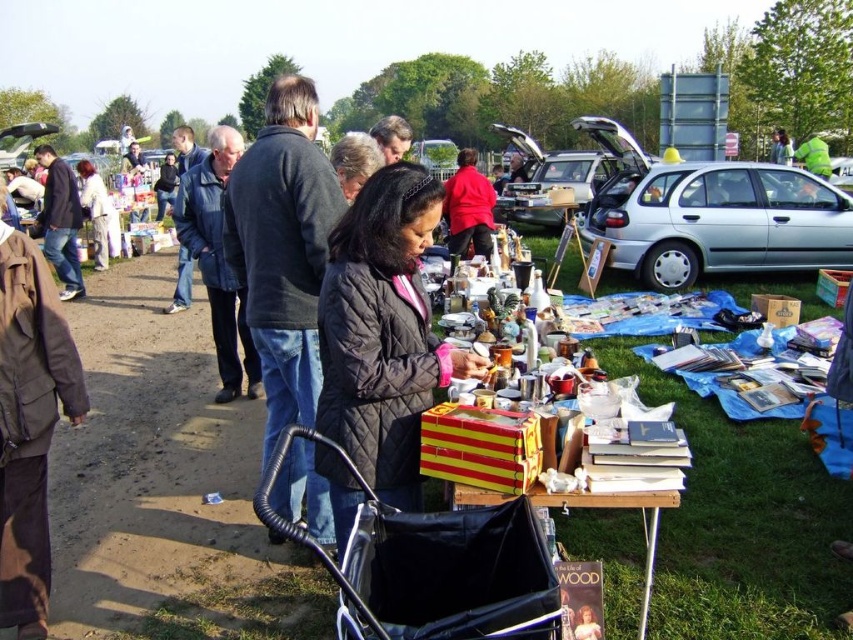
Is black quilted fabric baby carriage at lower center further to camera compared to silver metallic hatchback at center-right?

No.

What do you see at coordinates (431, 564) in the screenshot? I see `black quilted fabric baby carriage at lower center` at bounding box center [431, 564].

I want to click on black quilted fabric baby carriage at lower center, so click(x=431, y=564).

What do you see at coordinates (383, 332) in the screenshot? I see `black quilted jacket at center` at bounding box center [383, 332].

Is point (381, 497) behind point (527, 596)?

Yes, it is.

What are the coordinates of `black quilted jacket at center` in the screenshot? It's located at point(383,332).

This screenshot has width=853, height=640. Describe the element at coordinates (431, 564) in the screenshot. I see `black quilted fabric baby carriage at lower center` at that location.

Who is lower down, black quilted fabric baby carriage at lower center or white cotton jacket at center?

black quilted fabric baby carriage at lower center

The height and width of the screenshot is (640, 853). Find the location of `black quilted fabric baby carriage at lower center`. black quilted fabric baby carriage at lower center is located at coordinates (431, 564).